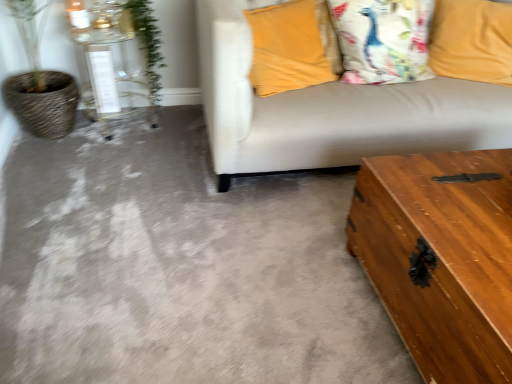
Image resolution: width=512 pixels, height=384 pixels. What do you see at coordinates (472, 41) in the screenshot?
I see `yellow fabric pillow at upper right, the 3th pillow from the left` at bounding box center [472, 41].

How much space does velvet yellow pillow at upper right, positioned as the third pillow in right-to-left order, occupy horizontally?

The width of velvet yellow pillow at upper right, positioned as the third pillow in right-to-left order, is 39.79 centimeters.

What do you see at coordinates (113, 73) in the screenshot?
I see `clear glass table at left, the first table from the back` at bounding box center [113, 73].

Where is `wooden trunk at lower right`? Image resolution: width=512 pixels, height=384 pixels. wooden trunk at lower right is located at coordinates (179, 268).

Describe the element at coordinates (441, 259) in the screenshot. I see `wooden trunk at lower right, acting as the 2th table starting from the top` at that location.

The height and width of the screenshot is (384, 512). What are the coordinates of `green leafy plant at upper left` in the screenshot? It's located at (148, 44).

Which is in front, yellow fabric pillow at upper right, the 3th pillow from the left, or wooden trunk at lower right, arranged as the second table when viewed from the back?

Positioned in front is wooden trunk at lower right, arranged as the second table when viewed from the back.

From a real-world perspective, who is located lower, yellow fabric pillow at upper right, the 3th pillow from the left, or wooden trunk at lower right, the 1th table ordered from the bottom?

wooden trunk at lower right, the 1th table ordered from the bottom, from a real-world perspective.

Does yellow fabric pillow at upper right, the first pillow from the right, turn towards wooden trunk at lower right, the first table in the right-to-left sequence?

Yes, yellow fabric pillow at upper right, the first pillow from the right, is aimed at wooden trunk at lower right, the first table in the right-to-left sequence.

From the image's perspective, is yellow fabric pillow at upper right, the 3th pillow from the left, above or below wooden trunk at lower right, the first table in the right-to-left sequence?

yellow fabric pillow at upper right, the 3th pillow from the left, is above wooden trunk at lower right, the first table in the right-to-left sequence.

Does yellow fabric pillow at upper right, the 3th pillow from the left, lie behind velvet yellow pillow at upper right, the 1th pillow in the left-to-right sequence?

Yes, yellow fabric pillow at upper right, the 3th pillow from the left, is further from the viewer.

Which object is thinner, yellow fabric pillow at upper right, the 3th pillow from the left, or velvet yellow pillow at upper right, positioned as the third pillow in right-to-left order?

yellow fabric pillow at upper right, the 3th pillow from the left, is thinner.

Are yellow fabric pillow at upper right, the first pillow from the right, and velvet yellow pillow at upper right, positioned as the third pillow in right-to-left order, making contact?

yellow fabric pillow at upper right, the first pillow from the right, and velvet yellow pillow at upper right, positioned as the third pillow in right-to-left order, are clearly separated.

What's the angular difference between yellow fabric pillow at upper right, the 3th pillow from the left, and velvet yellow pillow at upper right, positioned as the third pillow in right-to-left order,'s facing directions?

The angle between the facing direction of yellow fabric pillow at upper right, the 3th pillow from the left, and the facing direction of velvet yellow pillow at upper right, positioned as the third pillow in right-to-left order, is 53.9 degrees.

Where is `table in front of the wooden trunk at lower right`? The height and width of the screenshot is (384, 512). table in front of the wooden trunk at lower right is located at coordinates (441, 259).

Which object is further away from the camera taking this photo, wooden trunk at lower right or wooden trunk at lower right, which is the first table in front-to-back order?

wooden trunk at lower right is behind.

From a real-world perspective, is wooden trunk at lower right physically located above or below wooden trunk at lower right, acting as the 2th table starting from the top?

Clearly, from a real-world perspective, wooden trunk at lower right is below wooden trunk at lower right, acting as the 2th table starting from the top.

Is green leafy plant at upper left in contact with velvet yellow pillow at upper right, positioned as the third pillow in right-to-left order?

No, green leafy plant at upper left is not beside velvet yellow pillow at upper right, positioned as the third pillow in right-to-left order.

Considering the sizes of objects green leafy plant at upper left and velvet yellow pillow at upper right, the 1th pillow in the left-to-right sequence, in the image provided, who is wider, green leafy plant at upper left or velvet yellow pillow at upper right, the 1th pillow in the left-to-right sequence,?

velvet yellow pillow at upper right, the 1th pillow in the left-to-right sequence, is wider.

Is green leafy plant at upper left surrounding velvet yellow pillow at upper right, the 1th pillow in the left-to-right sequence?

Actually, velvet yellow pillow at upper right, the 1th pillow in the left-to-right sequence, is outside green leafy plant at upper left.

From the image's perspective, relative to velvet yellow pillow at upper right, positioned as the third pillow in right-to-left order, is green leafy plant at upper left above or below?

From the image's perspective, green leafy plant at upper left appears above velvet yellow pillow at upper right, positioned as the third pillow in right-to-left order.

The image size is (512, 384). Identify the location of the 2nd pillow positioned below the white cotton pillow at upper right, the 2th pillow positioned from the right (from a real-world perspective). (472, 41).

Considering the positions of objects white cotton pillow at upper right, the 2th pillow positioned from the right, and yellow fabric pillow at upper right, the first pillow from the right, in the image provided, who is more to the right, white cotton pillow at upper right, the 2th pillow positioned from the right, or yellow fabric pillow at upper right, the first pillow from the right,?

yellow fabric pillow at upper right, the first pillow from the right, is more to the right.

From a real-world perspective, is white cotton pillow at upper right, the second pillow viewed from the left, positioned above or below yellow fabric pillow at upper right, the 3th pillow from the left?

In terms of real-world spatial position, white cotton pillow at upper right, the second pillow viewed from the left, is above yellow fabric pillow at upper right, the 3th pillow from the left.

How distant is white cotton pillow at upper right, the 2th pillow positioned from the right, from yellow fabric pillow at upper right, the first pillow from the right?

white cotton pillow at upper right, the 2th pillow positioned from the right, is 33.71 centimeters away from yellow fabric pillow at upper right, the first pillow from the right.

Considering the sizes of wooden trunk at lower right, the 1th table ordered from the bottom, and yellow fabric pillow at upper right, the 3th pillow from the left, in the image, is wooden trunk at lower right, the 1th table ordered from the bottom, wider or thinner than yellow fabric pillow at upper right, the 3th pillow from the left,?

Clearly, wooden trunk at lower right, the 1th table ordered from the bottom, has more width compared to yellow fabric pillow at upper right, the 3th pillow from the left.

Which is in front, wooden trunk at lower right, the 2th table in the left-to-right sequence, or yellow fabric pillow at upper right, the 3th pillow from the left?

wooden trunk at lower right, the 2th table in the left-to-right sequence, is in front.

What's the angular difference between wooden trunk at lower right, arranged as the second table when viewed from the back, and yellow fabric pillow at upper right, the first pillow from the right,'s facing directions?

51.9 degrees.

Is yellow fabric pillow at upper right, the first pillow from the right, completely or partially inside wooden trunk at lower right, the 2th table in the left-to-right sequence?

No, yellow fabric pillow at upper right, the first pillow from the right, is not surrounded by wooden trunk at lower right, the 2th table in the left-to-right sequence.

Is green leafy plant at upper left directly adjacent to wooden trunk at lower right?

No, green leafy plant at upper left is not making contact with wooden trunk at lower right.

Locate an element on the screen. The height and width of the screenshot is (384, 512). plant behind the wooden trunk at lower right is located at coordinates click(x=148, y=44).

Does green leafy plant at upper left turn towards wooden trunk at lower right?

Yes.

Is green leafy plant at upper left taller than wooden trunk at lower right?

Indeed, green leafy plant at upper left has a greater height compared to wooden trunk at lower right.

You are a GUI agent. You are given a task and a screenshot of the screen. Output one action in this format:
    pyautogui.click(x=<x>, y=<y>)
    Task: Click on the 2nd pillow above when counting from the wooden trunk at lower right, acting as the 2th table starting from the top (from the image's perspective)
    This screenshot has width=512, height=384.
    Given the screenshot: What is the action you would take?
    pyautogui.click(x=472, y=41)

Image resolution: width=512 pixels, height=384 pixels. I want to click on pillow that is the 1st object above the yellow fabric pillow at upper right, the 3th pillow from the left (from a real-world perspective), so click(x=293, y=47).

Looking at the image, which one is located closer to wooden trunk at lower right, which is the first table in front-to-back order, clear glass table at left, the 2th table from the right, or green leafy plant at upper left?

clear glass table at left, the 2th table from the right, lies closer to wooden trunk at lower right, which is the first table in front-to-back order, than the other object.

Looking at the image, which one is located closer to white cotton pillow at upper right, the 2th pillow positioned from the right, wooden trunk at lower right, the 2th table in the left-to-right sequence, or green leafy plant at upper left?

wooden trunk at lower right, the 2th table in the left-to-right sequence, is positioned closer to the anchor white cotton pillow at upper right, the 2th pillow positioned from the right.

Which object lies nearer to the anchor point clear glass table at left, the first table from the back, green leafy plant at upper left or velvet yellow pillow at upper right, positioned as the third pillow in right-to-left order?

green leafy plant at upper left is closer to clear glass table at left, the first table from the back.

In the scene shown: Which object lies nearer to the anchor point green leafy plant at upper left, white cotton pillow at upper right, the second pillow viewed from the left, or wooden trunk at lower right?

The object closer to green leafy plant at upper left is white cotton pillow at upper right, the second pillow viewed from the left.

Looking at the image, which one is located further to velvet yellow pillow at upper right, positioned as the third pillow in right-to-left order, wooden trunk at lower right, acting as the 2th table starting from the top, or wooden trunk at lower right?

Among the two, wooden trunk at lower right, acting as the 2th table starting from the top, is located further to velvet yellow pillow at upper right, positioned as the third pillow in right-to-left order.

Based on their spatial positions, is clear glass table at left, the 2th table from the right, or yellow fabric pillow at upper right, the 3th pillow from the left, further from wooden trunk at lower right?

The object further to wooden trunk at lower right is yellow fabric pillow at upper right, the 3th pillow from the left.

From the image, which object appears to be nearer to yellow fabric pillow at upper right, the 3th pillow from the left, wooden trunk at lower right, acting as the 2th table starting from the top, or wooden trunk at lower right?

wooden trunk at lower right, acting as the 2th table starting from the top.

Based on the photo, when comparing their distances from wooden trunk at lower right, the 2th table in the left-to-right sequence, does green leafy plant at upper left or clear glass table at left, the 2th table from the right, seem further?

green leafy plant at upper left lies further to wooden trunk at lower right, the 2th table in the left-to-right sequence, than the other object.

Locate an element on the screen. The height and width of the screenshot is (384, 512). plant between clear glass table at left, the second table ordered from the bottom, and white cotton pillow at upper right, the 2th pillow positioned from the right is located at coordinates (148, 44).

I want to click on table between clear glass table at left, the second table from the front, and yellow fabric pillow at upper right, the first pillow from the right, from left to right, so click(x=441, y=259).

Locate an element on the screen. This screenshot has height=384, width=512. plant between wooden trunk at lower right and white cotton pillow at upper right, the 2th pillow positioned from the right, in the front-back direction is located at coordinates [x=148, y=44].

Where is `concrete between clear glass table at left, which is the 1th table in left-to-right order, and white cotton pillow at upper right, the second pillow viewed from the left`? concrete between clear glass table at left, which is the 1th table in left-to-right order, and white cotton pillow at upper right, the second pillow viewed from the left is located at coordinates (179, 268).